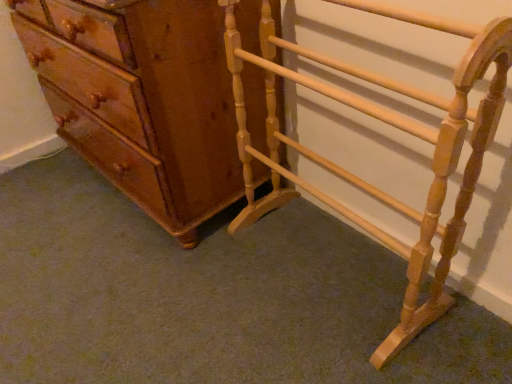
Question: From a real-world perspective, relative to matte brown chest of drawers at left, is light wood towel rack at right vertically above or below?

Choices:
 (A) below
 (B) above

Answer: (A)

Question: Based on their sizes in the image, would you say light wood towel rack at right is bigger or smaller than matte brown chest of drawers at left?

Choices:
 (A) small
 (B) big

Answer: (A)

Question: Is light wood towel rack at right wider or thinner than matte brown chest of drawers at left?

Choices:
 (A) thin
 (B) wide

Answer: (A)

Question: Is matte brown chest of drawers at left to the left or to the right of light wood towel rack at right in the image?

Choices:
 (A) left
 (B) right

Answer: (A)

Question: From a real-world perspective, is matte brown chest of drawers at left physically located above or below light wood towel rack at right?

Choices:
 (A) below
 (B) above

Answer: (B)

Question: Considering their positions, is matte brown chest of drawers at left located in front of or behind light wood towel rack at right?

Choices:
 (A) front
 (B) behind

Answer: (B)

Question: Is matte brown chest of drawers at left situated inside light wood towel rack at right or outside?

Choices:
 (A) inside
 (B) outside

Answer: (B)